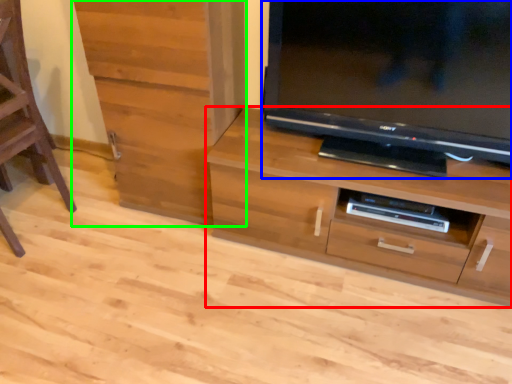
Question: Based on their relative distances, which object is nearer to chest of drawers (highlighted by a red box)? Choose from television (highlighted by a blue box) and cabinetry (highlighted by a green box).

Choices:
 (A) television
 (B) cabinetry

Answer: (A)